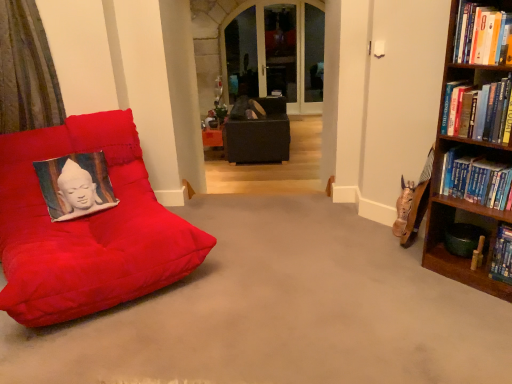
Question: Is suede red beanbag at left in front of or behind hardcover book at upper right, arranged as the first book when viewed from the top, in the image?

Choices:
 (A) behind
 (B) front

Answer: (B)

Question: From their relative heights in the image, would you say suede red beanbag at left is taller or shorter than hardcover book at upper right, acting as the 3th book starting from the bottom?

Choices:
 (A) short
 (B) tall

Answer: (B)

Question: Which object is the closest to the suede red beanbag at left?

Choices:
 (A) matte black bean bag at center
 (B) hardcover book at upper right, the 2th book ordered from the bottom
 (C) hardcover book at upper right, acting as the 3th book starting from the bottom
 (D) hardcover book at right, arranged as the 1th book when ordered from the bottom
 (E) textured fabric pillow at left

Answer: (E)

Question: Which object is the closest to the matte black bean bag at center?

Choices:
 (A) suede red beanbag at left
 (B) hardcover book at right, acting as the third book starting from the top
 (C) hardcover book at upper right, arranged as the 2th book when viewed from the top
 (D) hardcover book at upper right, acting as the 3th book starting from the bottom
 (E) textured fabric pillow at left

Answer: (A)